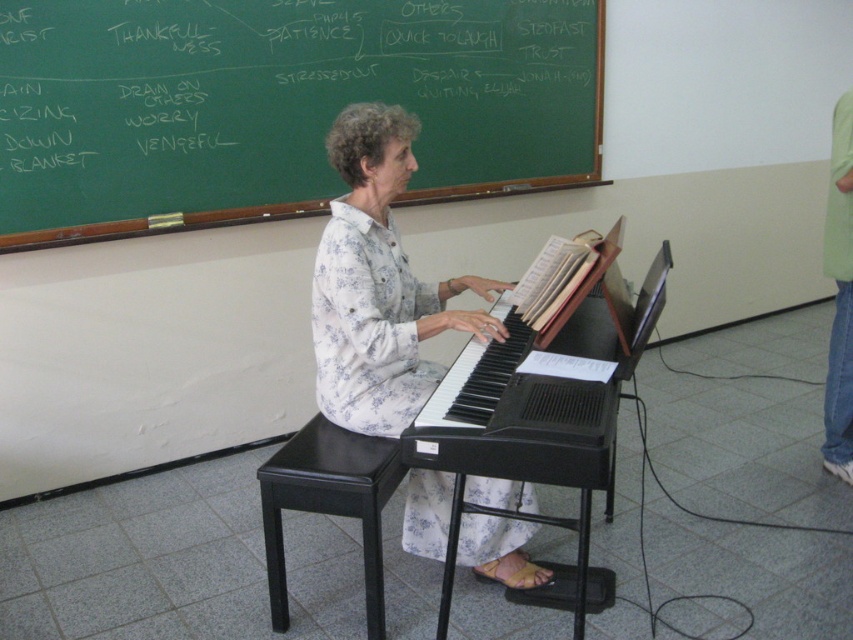
You are a student in the classroom and need to write a note on the green chalkboard at upper center and the white floral shirt at center. Which object allows you to write on it?

The green chalkboard at upper center allows you to write on it because it is a chalkboard, whereas the white floral shirt at center is clothing and cannot be written on.

You are a student in the classroom and need to write a note on the green chalkboard at upper center and the black leather stool at lower center. Which object is larger?

The green chalkboard at upper center is bigger than the black leather stool at lower center.